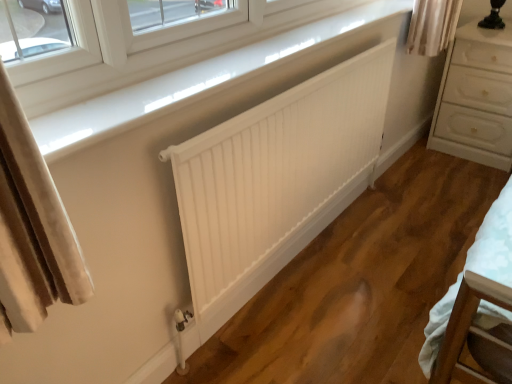
Question: From the image's perspective, is white glossy window sill at upper center under white matte radiator at center?

Choices:
 (A) no
 (B) yes

Answer: (A)

Question: Is white glossy window sill at upper center positioned before white matte radiator at center?

Choices:
 (A) no
 (B) yes

Answer: (B)

Question: Is white glossy window sill at upper center at the left side of white matte radiator at center?

Choices:
 (A) no
 (B) yes

Answer: (B)

Question: Is white glossy window sill at upper center looking in the opposite direction of white matte radiator at center?

Choices:
 (A) no
 (B) yes

Answer: (A)

Question: Is white glossy window sill at upper center far from white matte radiator at center?

Choices:
 (A) yes
 (B) no

Answer: (B)

Question: Considering the positions of point (474, 34) and point (227, 49), is point (474, 34) closer or farther from the camera than point (227, 49)?

Choices:
 (A) closer
 (B) farther

Answer: (B)

Question: Relative to white glossy window sill at upper center, is white glossy chest of drawers at right in front or behind?

Choices:
 (A) behind
 (B) front

Answer: (A)

Question: Which is correct: white glossy chest of drawers at right is inside white glossy window sill at upper center, or outside of it?

Choices:
 (A) outside
 (B) inside

Answer: (A)

Question: In the image, is white glossy chest of drawers at right on the left side or the right side of white glossy window sill at upper center?

Choices:
 (A) left
 (B) right

Answer: (B)

Question: From a real-world perspective, is white glossy chest of drawers at right physically located above or below white matte radiator at center?

Choices:
 (A) above
 (B) below

Answer: (B)

Question: Is white glossy chest of drawers at right inside the boundaries of white matte radiator at center, or outside?

Choices:
 (A) inside
 (B) outside

Answer: (B)

Question: Is white glossy chest of drawers at right to the left or to the right of white matte radiator at center in the image?

Choices:
 (A) right
 (B) left

Answer: (A)

Question: Is point (458, 135) closer or farther from the camera than point (354, 92)?

Choices:
 (A) farther
 (B) closer

Answer: (A)

Question: In terms of height, does white glossy window sill at upper center look taller or shorter compared to white glossy chest of drawers at right?

Choices:
 (A) tall
 (B) short

Answer: (B)

Question: From the image's perspective, is white glossy window sill at upper center located above or below white glossy chest of drawers at right?

Choices:
 (A) below
 (B) above

Answer: (A)